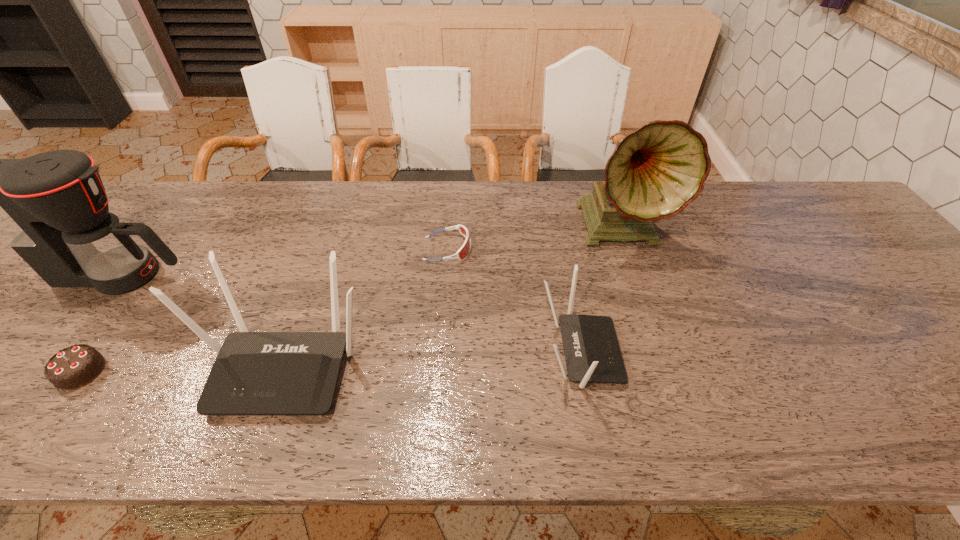
I want to click on vacant space that satisfies the following two spatial constraints: 1. on the front-facing side of the fourth object from left to right; 2. on the front-facing side of the fourth shortest object, so click(439, 364).

Identify the location of vacant area in the image that satisfies the following two spatial constraints: 1. from the horn of the record player; 2. pour from the carafe of the coffee maker. (637, 275).

I want to click on free space that satisfies the following two spatial constraints: 1. on the back side of the second shortest object; 2. pour from the carafe of the coffee maker, so click(x=151, y=275).

Image resolution: width=960 pixels, height=540 pixels. I want to click on vacant area in the image that satisfies the following two spatial constraints: 1. on the front-facing side of the shortest object; 2. on the front side of the second shortest object, so click(x=438, y=372).